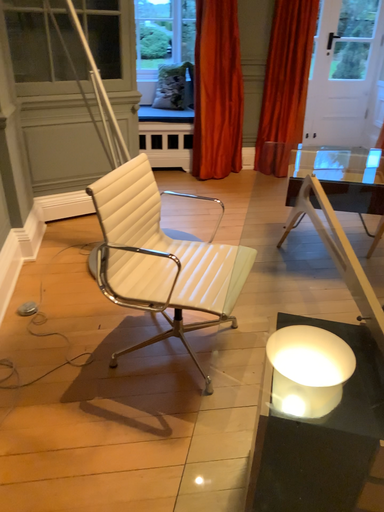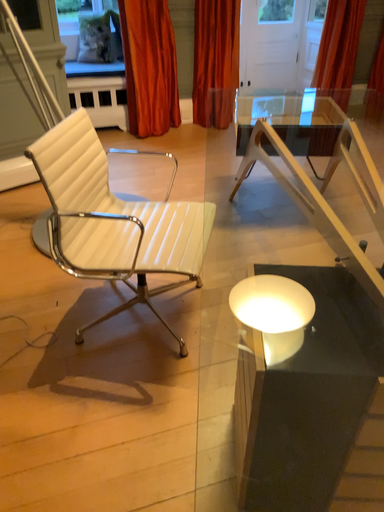
Question: Which way did the camera rotate in the video?

Choices:
 (A) rotated right
 (B) rotated left

Answer: (A)